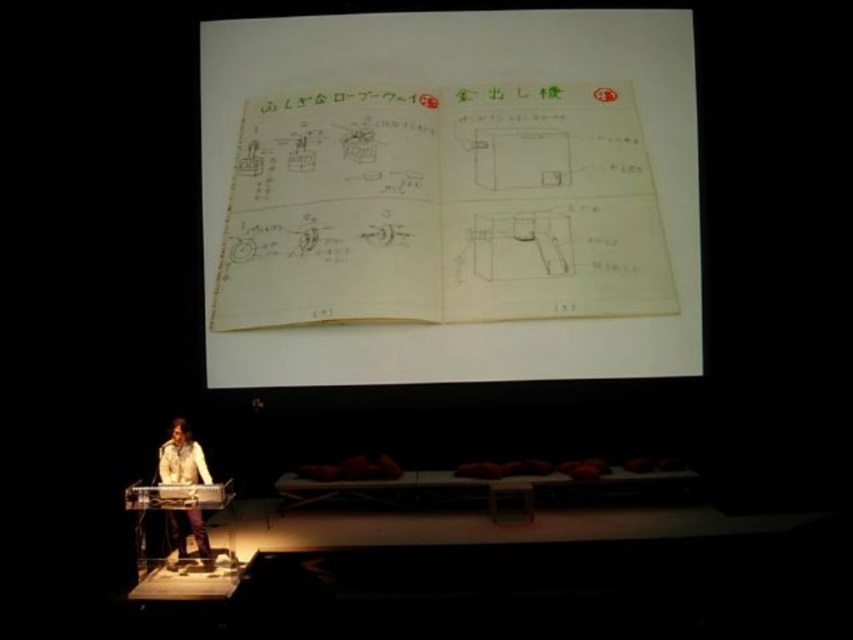
Describe the element at coordinates (450, 196) in the screenshot. The height and width of the screenshot is (640, 853). I see `yellow paper notebook at center` at that location.

Can you confirm if yellow paper notebook at center is thinner than light brown leather jacket at lower left?

No, yellow paper notebook at center is not thinner than light brown leather jacket at lower left.

Which is behind, point (515, 220) or point (194, 458)?

The point (515, 220) is more distant.

At what (x,y) coordinates should I click in order to perform the action: click on yellow paper notebook at center. Please return your answer as a coordinate pair (x, y). Looking at the image, I should click on tap(450, 196).